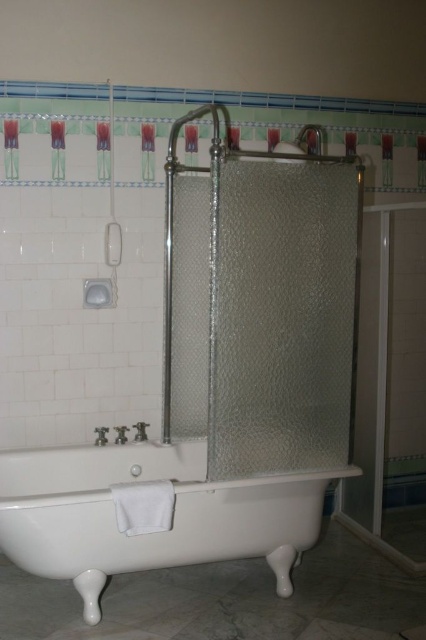
You are planning to install a new faucet on the bathroom wall. The faucet requires a minimum of 1.2 meters of space in front of it to avoid obstruction. You want to place it between the white glossy bathtub at lower center and the clear glass shower at upper center. Is there enough space?

The white glossy bathtub at lower center is bigger than the clear glass shower at upper center. However, the description does not provide specific measurements of the distance between them. Therefore, it is unclear if there is enough space to install the faucet with the required 1.2 meters of clearance.

You are standing in the bathroom and want to take a shower. Which object should you approach first, the white glossy bathtub at lower center or the clear glass shower at upper center?

You should approach the white glossy bathtub at lower center first because it is in front of the clear glass shower at upper center, making it closer to you.